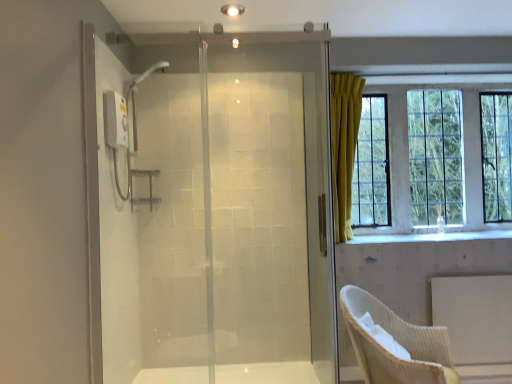
Question: Is yellow fabric curtain at upper right inside the boundaries of woven beige chair at lower right, or outside?

Choices:
 (A) outside
 (B) inside

Answer: (A)

Question: Considering the positions of point (410, 198) and point (376, 301), is point (410, 198) closer or farther from the camera than point (376, 301)?

Choices:
 (A) farther
 (B) closer

Answer: (A)

Question: Estimate the real-world distances between objects in this image. Which object is closer to the yellow fabric curtain at upper right?

Choices:
 (A) woven beige chair at lower right
 (B) transparent glass shower door at center

Answer: (A)

Question: Based on their relative distances, which object is farther from the yellow fabric curtain at upper right?

Choices:
 (A) transparent glass shower door at center
 (B) woven beige chair at lower right

Answer: (A)